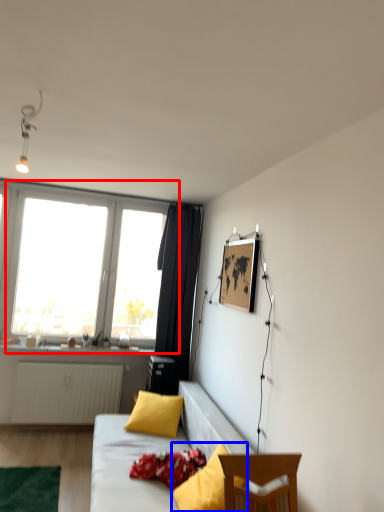
Question: Among these objects, which one is farthest to the camera, window (highlighted by a red box) or pillow (highlighted by a blue box)?

Choices:
 (A) window
 (B) pillow

Answer: (A)